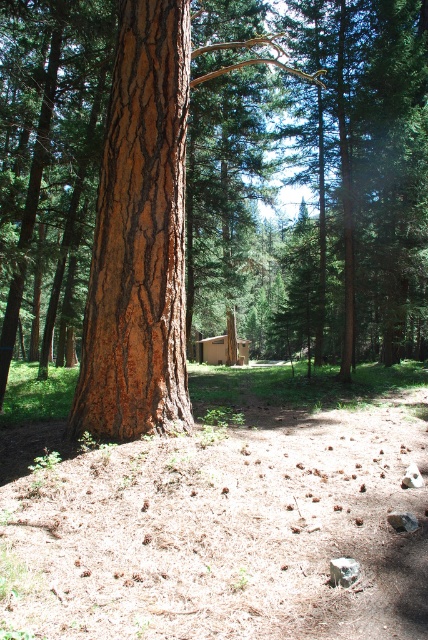
Question: Does brown rough bark tree at center appear on the right side of brown wooden cabin at center?

Choices:
 (A) yes
 (B) no

Answer: (B)

Question: Is brown rough bark tree at center below brown wooden cabin at center?

Choices:
 (A) yes
 (B) no

Answer: (B)

Question: Which object is farther from the camera taking this photo?

Choices:
 (A) brown wooden cabin at center
 (B) brown rough bark tree at center

Answer: (A)

Question: Is brown rough bark tree at center smaller than brown wooden cabin at center?

Choices:
 (A) no
 (B) yes

Answer: (A)